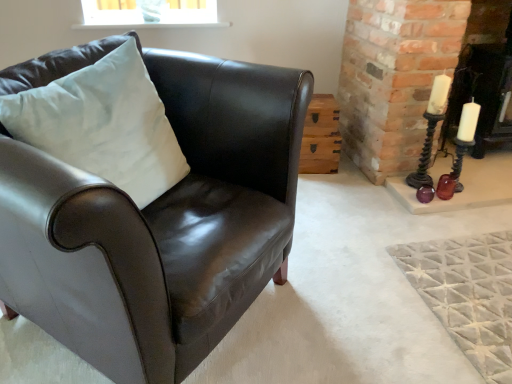
Question: Can you confirm if white satin pillow at left is wider than metallic dark brown candle holder at right?

Choices:
 (A) yes
 (B) no

Answer: (A)

Question: Is white satin pillow at left positioned in front of metallic dark brown candle holder at right?

Choices:
 (A) yes
 (B) no

Answer: (A)

Question: Considering the relative positions of white satin pillow at left and metallic dark brown candle holder at right in the image provided, is white satin pillow at left to the right of metallic dark brown candle holder at right from the viewer's perspective?

Choices:
 (A) no
 (B) yes

Answer: (A)

Question: Can you confirm if white satin pillow at left is thinner than metallic dark brown candle holder at right?

Choices:
 (A) no
 (B) yes

Answer: (A)

Question: Is the position of white satin pillow at left more distant than that of metallic dark brown candle holder at right?

Choices:
 (A) no
 (B) yes

Answer: (A)

Question: Is white satin pillow at left smaller than metallic dark brown candle holder at right?

Choices:
 (A) yes
 (B) no

Answer: (B)

Question: Is the depth of wooden crate at center-right less than that of metallic dark brown candle holder at right?

Choices:
 (A) yes
 (B) no

Answer: (B)

Question: Is wooden crate at center-right to the right of metallic dark brown candle holder at right from the viewer's perspective?

Choices:
 (A) no
 (B) yes

Answer: (A)

Question: Is wooden crate at center-right positioned behind metallic dark brown candle holder at right?

Choices:
 (A) yes
 (B) no

Answer: (A)

Question: From the image's perspective, does wooden crate at center-right appear higher than metallic dark brown candle holder at right?

Choices:
 (A) yes
 (B) no

Answer: (B)

Question: Is wooden crate at center-right not within metallic dark brown candle holder at right?

Choices:
 (A) yes
 (B) no

Answer: (A)

Question: From a real-world perspective, is wooden crate at center-right over metallic dark brown candle holder at right?

Choices:
 (A) no
 (B) yes

Answer: (A)

Question: Can you confirm if white satin pillow at left is wider than wooden crate at center-right?

Choices:
 (A) yes
 (B) no

Answer: (A)